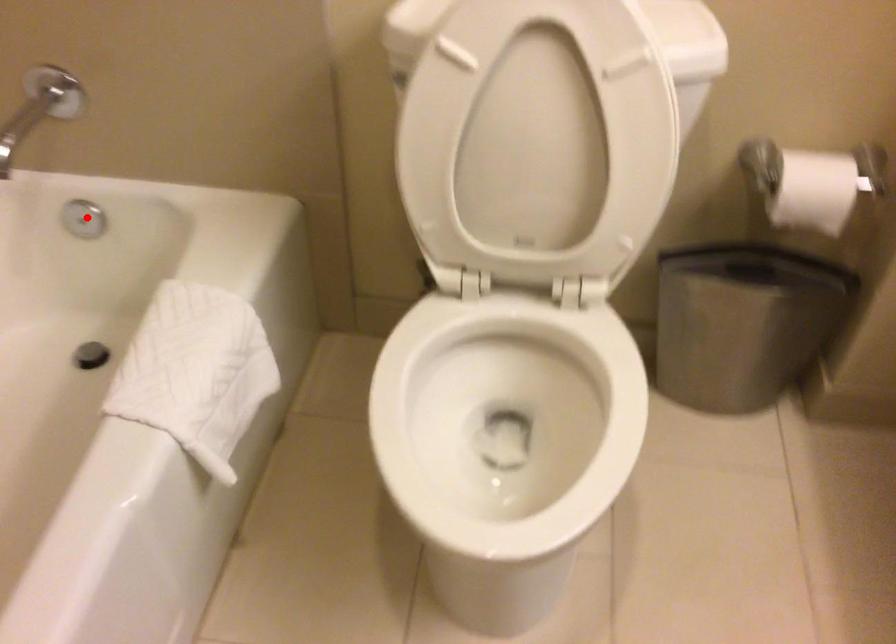
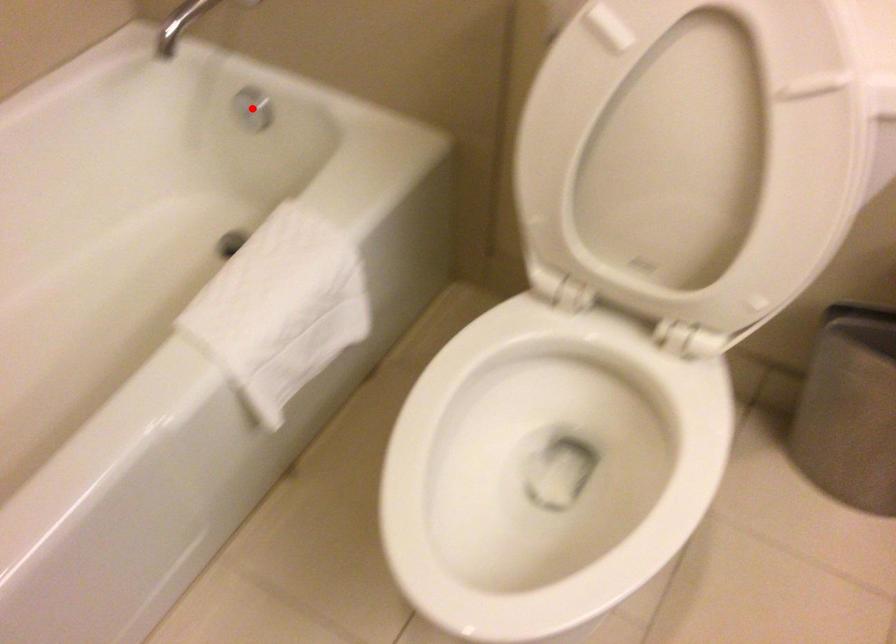
I am providing you with two images of the same scene from different viewpoints. A red point is marked on the first image and another point is marked on the second image. Is the red point in image1 aligned with the point shown in image2?

Yes